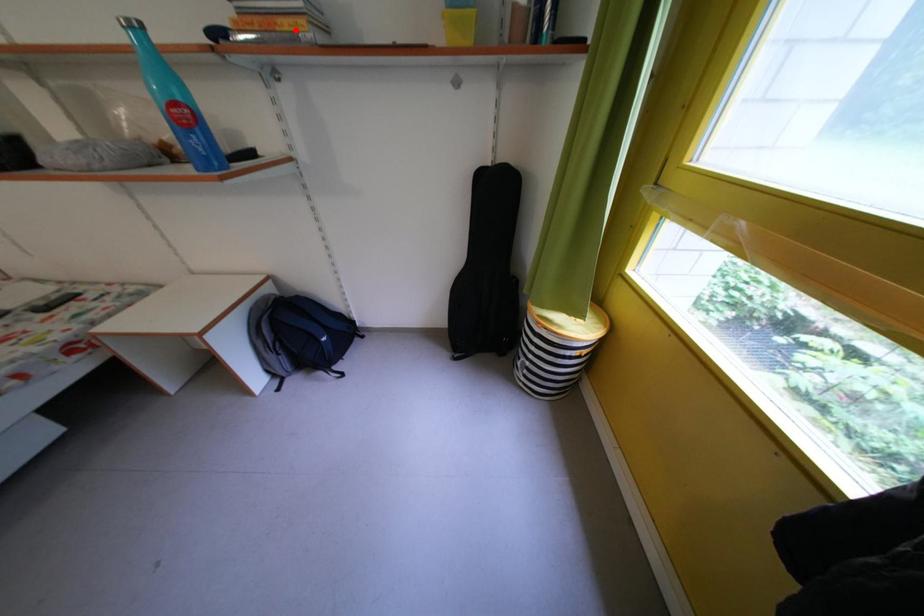
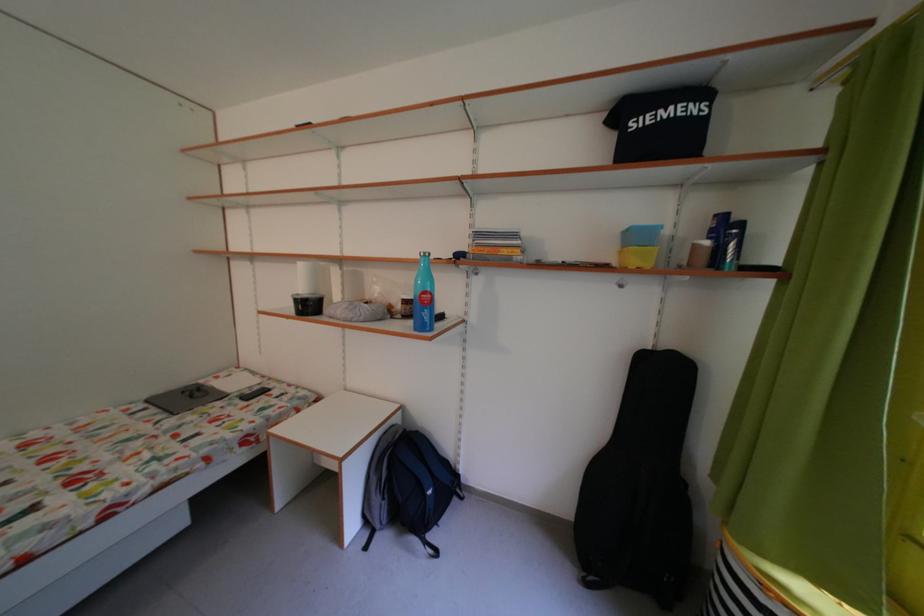
The point at the highlighted location is marked in the first image. Where is the corresponding point in the second image?

(515, 257)